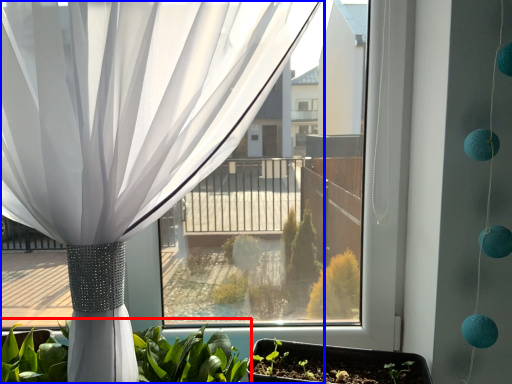
Question: Which object appears farthest to the camera in this image, houseplant (highlighted by a red box) or curtain (highlighted by a blue box)?

Choices:
 (A) houseplant
 (B) curtain

Answer: (A)